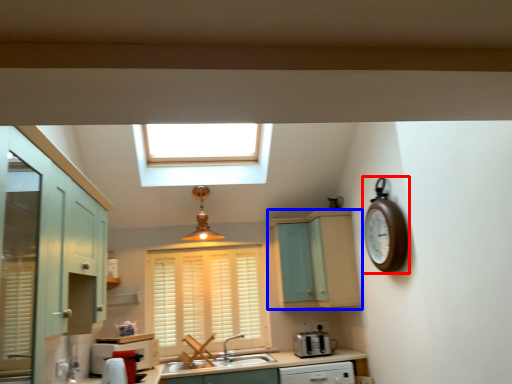
Question: Which object is closer to the camera taking this photo, clock (highlighted by a red box) or cabinetry (highlighted by a blue box)?

Choices:
 (A) clock
 (B) cabinetry

Answer: (A)